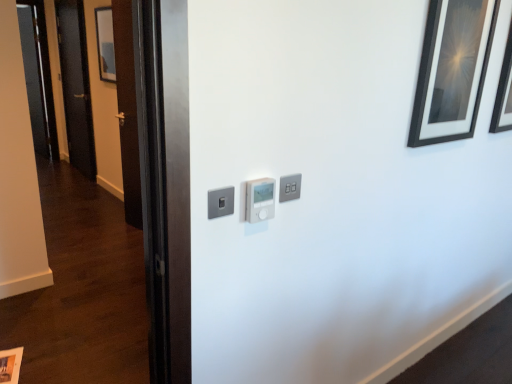
The width and height of the screenshot is (512, 384). Describe the element at coordinates (504, 92) in the screenshot. I see `black glossy picture frame at upper right, acting as the third picture frame starting from the bottom` at that location.

How much space does matte white picture frame at lower left, placed as the third picture frame when sorted from right to left, occupy horizontally?

The width of matte white picture frame at lower left, placed as the third picture frame when sorted from right to left, is 11.33 inches.

Image resolution: width=512 pixels, height=384 pixels. Describe the element at coordinates (105, 44) in the screenshot. I see `matte black picture frame at upper left, marked as the first picture frame in a left-to-right arrangement` at that location.

The height and width of the screenshot is (384, 512). Describe the element at coordinates (38, 76) in the screenshot. I see `transparent glass door at left` at that location.

Where is `transparent glass door at left`? transparent glass door at left is located at coordinates (38, 76).

What do you see at coordinates (76, 85) in the screenshot?
I see `black matte door at left` at bounding box center [76, 85].

In order to face satin silver light switch at upper center, the first light switch positioned from the right, should I rotate leftwards or rightwards?

You should rotate right by 4.746 degrees.

This screenshot has height=384, width=512. Describe the element at coordinates (290, 187) in the screenshot. I see `satin silver light switch at upper center, which is the third light switch in left-to-right order` at that location.

The height and width of the screenshot is (384, 512). I want to click on black matte picture frame at upper right, placed as the 4th picture frame when sorted from back to front, so click(x=452, y=70).

The width and height of the screenshot is (512, 384). I want to click on black glossy picture frame at upper right, the fourth picture frame from the left, so click(x=504, y=92).

Considering the positions of objects matte black picture frame at upper left, the fourth picture frame ordered from the bottom, and matte white picture frame at lower left, placed as the third picture frame when sorted from right to left, in the image provided, who is behind, matte black picture frame at upper left, the fourth picture frame ordered from the bottom, or matte white picture frame at lower left, placed as the third picture frame when sorted from right to left,?

matte black picture frame at upper left, the fourth picture frame ordered from the bottom.

Can you see matte black picture frame at upper left, positioned as the 4th picture frame in front-to-back order, touching matte white picture frame at lower left, which is the second picture frame from left to right?

There is a gap between matte black picture frame at upper left, positioned as the 4th picture frame in front-to-back order, and matte white picture frame at lower left, which is the second picture frame from left to right.

Based on the photo, in terms of width, does matte black picture frame at upper left, which is the fourth picture frame in right-to-left order, look wider or thinner when compared to matte white picture frame at lower left, which ranks as the 1th picture frame in bottom-to-top order?

matte black picture frame at upper left, which is the fourth picture frame in right-to-left order, is thinner than matte white picture frame at lower left, which ranks as the 1th picture frame in bottom-to-top order.

From the image's perspective, is matte black picture frame at upper left, marked as the first picture frame in a left-to-right arrangement, located above matte white picture frame at lower left, arranged as the 2th picture frame when viewed from the back?

Correct, matte black picture frame at upper left, marked as the first picture frame in a left-to-right arrangement, appears higher than matte white picture frame at lower left, arranged as the 2th picture frame when viewed from the back, in the image.

What's the angular difference between matte black picture frame at upper left, positioned as the 4th picture frame in front-to-back order, and black matte picture frame at upper right, placed as the 4th picture frame when sorted from back to front,'s facing directions?

The facing directions of matte black picture frame at upper left, positioned as the 4th picture frame in front-to-back order, and black matte picture frame at upper right, placed as the 4th picture frame when sorted from back to front, are 89.4 degrees apart.

Which is less distant, (101, 72) or (462, 2)?

Clearly, point (101, 72) is more distant from the camera than point (462, 2).

Considering the relative sizes of matte black picture frame at upper left, the fourth picture frame ordered from the bottom, and black matte picture frame at upper right, positioned as the 3th picture frame in left-to-right order, in the image provided, is matte black picture frame at upper left, the fourth picture frame ordered from the bottom, thinner than black matte picture frame at upper right, positioned as the 3th picture frame in left-to-right order,?

Yes, matte black picture frame at upper left, the fourth picture frame ordered from the bottom, is thinner than black matte picture frame at upper right, positioned as the 3th picture frame in left-to-right order.

Can you confirm if matte black picture frame at upper left, marked as the first picture frame in a left-to-right arrangement, is bigger than black matte picture frame at upper right, placed as the 4th picture frame when sorted from back to front?

No, matte black picture frame at upper left, marked as the first picture frame in a left-to-right arrangement, is not bigger than black matte picture frame at upper right, placed as the 4th picture frame when sorted from back to front.

Is transparent glass door at left in front of or behind black matte door at left in the image?

Clearly, transparent glass door at left is behind black matte door at left.

Is transparent glass door at left directly adjacent to black matte door at left?

transparent glass door at left is not next to black matte door at left, and they're not touching.

How distant is transparent glass door at left from black matte door at left?

A distance of 22.97 inches exists between transparent glass door at left and black matte door at left.

Considering the sizes of objects transparent glass door at left and black matte door at left in the image provided, who is bigger, transparent glass door at left or black matte door at left?

Bigger between the two is black matte door at left.

Considering the relative sizes of white plastic thermostat at center, the 2th light switch from the left, and transparent glass door at left in the image provided, is white plastic thermostat at center, the 2th light switch from the left, bigger than transparent glass door at left?

Incorrect, white plastic thermostat at center, the 2th light switch from the left, is not larger than transparent glass door at left.

Considering the relative sizes of white plastic thermostat at center, placed as the second light switch when sorted from right to left, and transparent glass door at left in the image provided, is white plastic thermostat at center, placed as the second light switch when sorted from right to left, wider than transparent glass door at left?

Indeed, white plastic thermostat at center, placed as the second light switch when sorted from right to left, has a greater width compared to transparent glass door at left.

Which is in front, white plastic thermostat at center, the 2th light switch from the left, or transparent glass door at left?

Positioned in front is white plastic thermostat at center, the 2th light switch from the left.

Is white plastic thermostat at center, the 2th light switch from the left, at the right side of transparent glass door at left?

Yes.

How many degrees apart are the facing directions of black matte door at left and matte white picture frame at lower left, which is the fourth picture frame in top-to-bottom order?

70.9 degrees.

From a real-world perspective, relative to matte white picture frame at lower left, arranged as the 2th picture frame when viewed from the back, is black matte door at left vertically above or below?

From a real-world perspective, black matte door at left is physically above matte white picture frame at lower left, arranged as the 2th picture frame when viewed from the back.

In the scene shown: Relative to matte white picture frame at lower left, which ranks as the 1th picture frame in bottom-to-top order, is black matte door at left in front or behind?

black matte door at left is positioned farther from the viewer than matte white picture frame at lower left, which ranks as the 1th picture frame in bottom-to-top order.

Is point (115, 69) closer or farther from the camera than point (506, 102)?

Point (115, 69) is farther from the camera than point (506, 102).

Could you measure the distance between matte black picture frame at upper left, which is the fourth picture frame in right-to-left order, and black glossy picture frame at upper right, acting as the third picture frame starting from the bottom?

The distance of matte black picture frame at upper left, which is the fourth picture frame in right-to-left order, from black glossy picture frame at upper right, acting as the third picture frame starting from the bottom, is 10.47 feet.

Relative to black glossy picture frame at upper right, arranged as the first picture frame when viewed from the right, is matte black picture frame at upper left, which is the fourth picture frame in right-to-left order, in front or behind?

In the image, matte black picture frame at upper left, which is the fourth picture frame in right-to-left order, appears behind black glossy picture frame at upper right, arranged as the first picture frame when viewed from the right.

Does matte black picture frame at upper left, marked as the first picture frame in a left-to-right arrangement, appear on the right side of black glossy picture frame at upper right, the fourth picture frame from the left?

In fact, matte black picture frame at upper left, marked as the first picture frame in a left-to-right arrangement, is to the left of black glossy picture frame at upper right, the fourth picture frame from the left.

Find the location of `light switch that is the 1st object located in front of the satin silver light switch at upper center, the first light switch positioned from the right`. light switch that is the 1st object located in front of the satin silver light switch at upper center, the first light switch positioned from the right is located at coordinates (260, 200).

Which is correct: white plastic thermostat at center, placed as the second light switch when sorted from right to left, is inside satin silver light switch at upper center, which is the third light switch in left-to-right order, or outside of it?

white plastic thermostat at center, placed as the second light switch when sorted from right to left, is not inside satin silver light switch at upper center, which is the third light switch in left-to-right order, it's outside.

Is white plastic thermostat at center, the 2th light switch from the left, placed right next to satin silver light switch at upper center, the first light switch positioned from the right?

Yes, white plastic thermostat at center, the 2th light switch from the left, and satin silver light switch at upper center, the first light switch positioned from the right, clearly make contact.

The height and width of the screenshot is (384, 512). In order to click on picture frame that is the 3rd one when counting downward from the matte black picture frame at upper left, marked as the first picture frame in a left-to-right arrangement (from the image's perspective) in this screenshot , I will do `click(10, 365)`.

From a real-world perspective, which picture frame is the 1st one underneath the matte black picture frame at upper left, which is the fourth picture frame in right-to-left order? Please provide its 2D coordinates.

[(452, 70)]

Looking at the image, which one is located further to matte white picture frame at lower left, placed as the third picture frame when sorted from right to left, white plastic thermostat at center, placed as the second light switch when sorted from right to left, or black matte door at left?

The object further to matte white picture frame at lower left, placed as the third picture frame when sorted from right to left, is black matte door at left.

Which object lies nearer to the anchor point white plastic thermostat at center, placed as the second light switch when sorted from right to left, black glossy picture frame at upper right, marked as the third picture frame in a back-to-front arrangement, or satin silver light switch at upper center, the first light switch positioned from the right?

satin silver light switch at upper center, the first light switch positioned from the right.

Based on their spatial positions, is transparent glass door at left or black glossy picture frame at upper right, the fourth picture frame from the left, closer to satin silver switch at center, the third light switch when ordered from right to left?

Among the two, black glossy picture frame at upper right, the fourth picture frame from the left, is located nearer to satin silver switch at center, the third light switch when ordered from right to left.

Which object lies nearer to the anchor point matte black picture frame at upper left, which is the 1th picture frame in back-to-front order, transparent glass door at left or black glossy picture frame at upper right, arranged as the first picture frame when viewed from the right?

The object closer to matte black picture frame at upper left, which is the 1th picture frame in back-to-front order, is transparent glass door at left.

Looking at the image, which one is located further to satin silver light switch at upper center, the first light switch positioned from the right, black matte door at left or matte black picture frame at upper left, which is the fourth picture frame in right-to-left order?

black matte door at left.

When comparing their distances from matte black picture frame at upper left, which is the fourth picture frame in right-to-left order, does black glossy picture frame at upper right, acting as the 2th picture frame starting from the front, or black matte door at left seem further?

black glossy picture frame at upper right, acting as the 2th picture frame starting from the front, is further to matte black picture frame at upper left, which is the fourth picture frame in right-to-left order.

When comparing their distances from satin silver light switch at upper center, which is the third light switch in left-to-right order, does satin silver switch at center, the third light switch when ordered from right to left, or matte black picture frame at upper left, positioned as the 4th picture frame in front-to-back order, seem further?

Among the two, matte black picture frame at upper left, positioned as the 4th picture frame in front-to-back order, is located further to satin silver light switch at upper center, which is the third light switch in left-to-right order.

Based on the photo, which object lies further to the anchor point black matte door at left, matte black picture frame at upper left, which is the fourth picture frame in right-to-left order, or satin silver light switch at upper center, which is the third light switch in left-to-right order?

satin silver light switch at upper center, which is the third light switch in left-to-right order, is positioned further to the anchor black matte door at left.

Locate an element on the screen. The width and height of the screenshot is (512, 384). picture frame between satin silver switch at center, the third light switch when ordered from right to left, and black glossy picture frame at upper right, marked as the third picture frame in a back-to-front arrangement, in the horizontal direction is located at coordinates (452, 70).

The width and height of the screenshot is (512, 384). In order to click on door located between satin silver light switch at upper center, the first light switch positioned from the right, and transparent glass door at left in the depth direction in this screenshot , I will do 76,85.

The width and height of the screenshot is (512, 384). Identify the location of picture frame between matte white picture frame at lower left, placed as the third picture frame when sorted from right to left, and transparent glass door at left in the front-back direction. (105, 44).

Image resolution: width=512 pixels, height=384 pixels. What are the coordinates of `door between white plastic thermostat at center, the 2th light switch from the left, and transparent glass door at left, along the z-axis` in the screenshot? It's located at (76, 85).